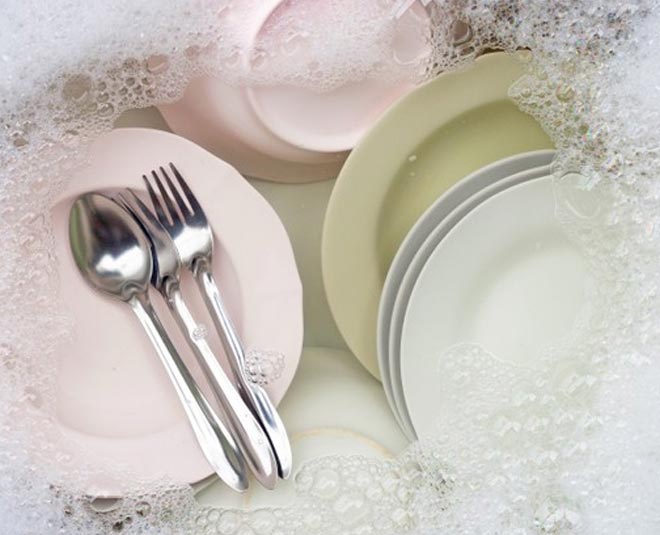
The image size is (660, 535). What are the coordinates of `dishes` in the screenshot? It's located at (244, 216), (327, 402), (457, 241), (433, 238), (424, 228), (387, 156), (205, 89).